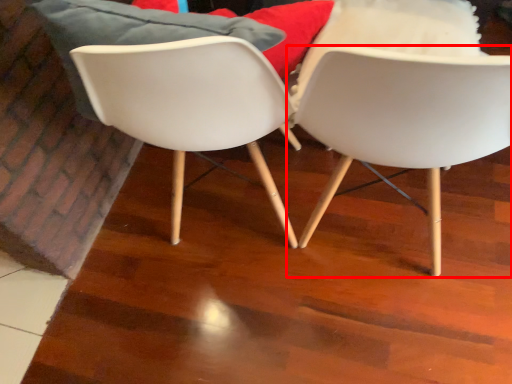
Question: Observing the image, what is the correct spatial positioning of chair (annotated by the red box) in reference to chair?

Choices:
 (A) right
 (B) left

Answer: (A)